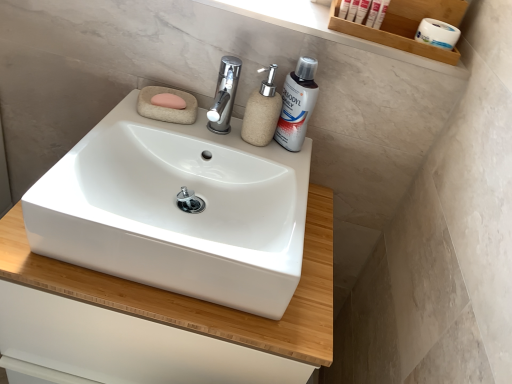
Where is `vacant space to the left of white matte tube at upper right`? The width and height of the screenshot is (512, 384). vacant space to the left of white matte tube at upper right is located at coordinates (302, 15).